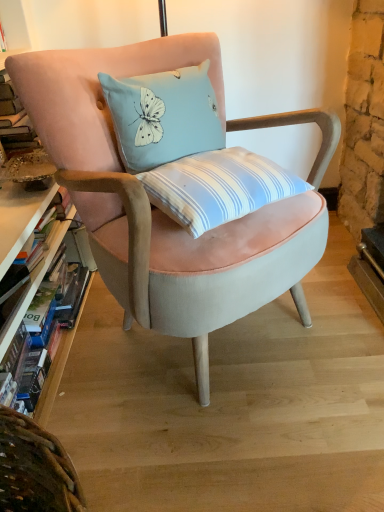
Question: Does hardcover book at left turn towards velvet pink chair at center?

Choices:
 (A) no
 (B) yes

Answer: (B)

Question: From a real-world perspective, is hardcover book at left over velvet pink chair at center?

Choices:
 (A) no
 (B) yes

Answer: (A)

Question: From the image's perspective, is hardcover book at left above velvet pink chair at center?

Choices:
 (A) yes
 (B) no

Answer: (B)

Question: Is hardcover book at left turned away from velvet pink chair at center?

Choices:
 (A) yes
 (B) no

Answer: (B)

Question: Can you confirm if hardcover book at left is thinner than velvet pink chair at center?

Choices:
 (A) no
 (B) yes

Answer: (B)

Question: Is velvet pink chair at center located within hardcover book at left?

Choices:
 (A) no
 (B) yes

Answer: (A)

Question: Is velvet pink chair at center at the left side of hardcover book at left?

Choices:
 (A) yes
 (B) no

Answer: (B)

Question: Can you see velvet pink chair at center touching hardcover book at left?

Choices:
 (A) no
 (B) yes

Answer: (A)

Question: From a real-world perspective, is velvet pink chair at center on top of hardcover book at left?

Choices:
 (A) no
 (B) yes

Answer: (B)

Question: From a real-world perspective, is velvet pink chair at center under hardcover book at left?

Choices:
 (A) no
 (B) yes

Answer: (A)

Question: Is velvet pink chair at center outside of hardcover book at left?

Choices:
 (A) yes
 (B) no

Answer: (A)

Question: Does velvet pink chair at center appear on the right side of hardcover book at left?

Choices:
 (A) yes
 (B) no

Answer: (A)

Question: From the image's perspective, relative to velvet pink chair at center, is hardcover book at left above or below?

Choices:
 (A) below
 (B) above

Answer: (A)